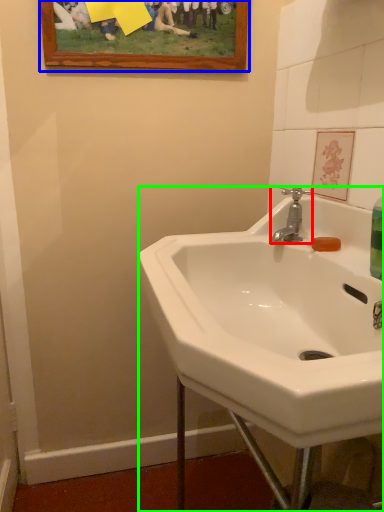
Question: Which object is the farthest from tap (highlighted by a red box)? Choose among these: picture frame (highlighted by a blue box) or sink (highlighted by a green box).

Choices:
 (A) picture frame
 (B) sink

Answer: (A)